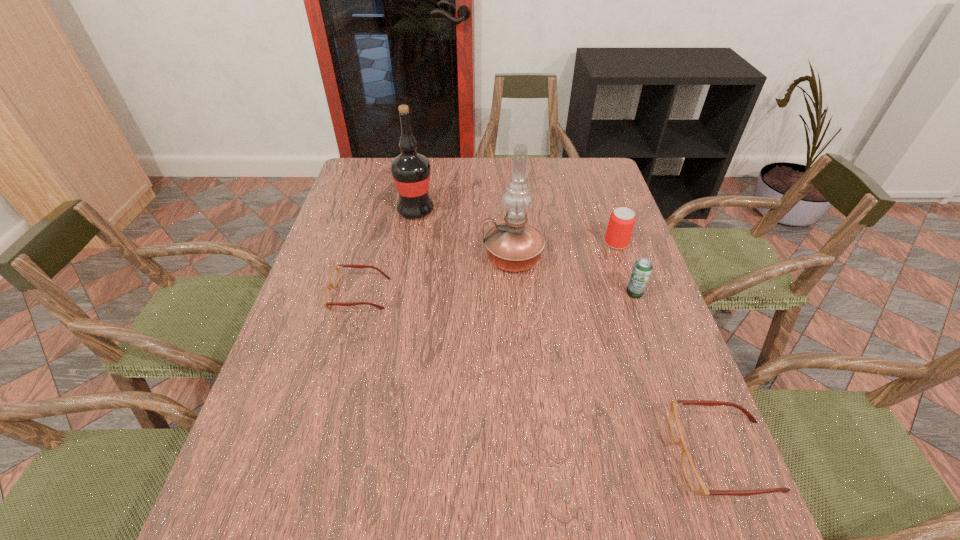
Locate an element on the screen. vacant space at the left edge of the desktop is located at coordinates (332, 316).

Find the location of a particular element. The height and width of the screenshot is (540, 960). free space at the right edge of the desktop is located at coordinates (628, 346).

In the image, there is a desktop. Identify the location of free region at the far right corner. The image size is (960, 540). (602, 190).

The image size is (960, 540). What are the coordinates of `free point between the wine bottle and the third object from left to right` in the screenshot? It's located at (465, 234).

Find the location of a particular element. free space between the taller spectacles and the oil lamp is located at coordinates (618, 356).

Find the location of a particular element. The width and height of the screenshot is (960, 540). empty space that is in between the farther beer can and the left spectacles is located at coordinates (488, 268).

What are the coordinates of `unoccupied position between the nearer beer can and the nearest object` in the screenshot? It's located at (679, 374).

The image size is (960, 540). I want to click on unoccupied position between the second shortest object and the nearer beer can, so click(x=679, y=374).

The image size is (960, 540). I want to click on vacant space that's between the farther spectacles and the taller spectacles, so click(x=541, y=375).

At what (x,y) coordinates should I click in order to perform the action: click on vacant point located between the nearest object and the left spectacles. Please return your answer as a coordinate pair (x, y). This screenshot has width=960, height=540. Looking at the image, I should click on (541, 375).